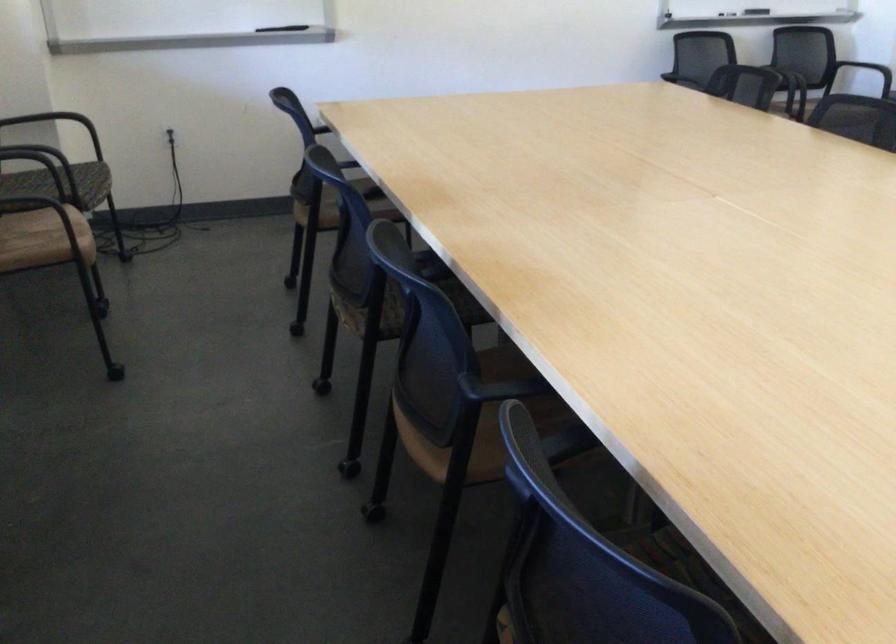
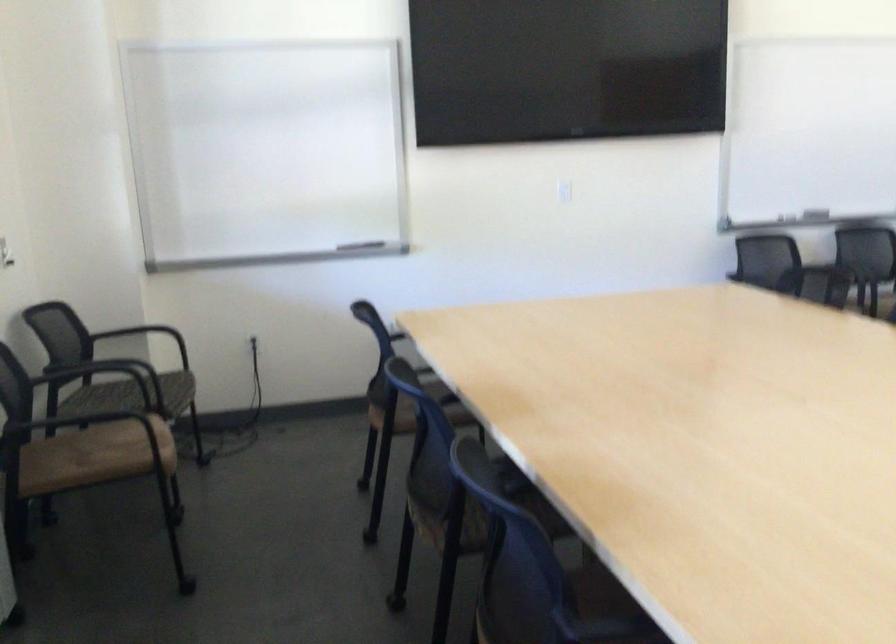
Question: How did the camera likely rotate?

Choices:
 (A) Left
 (B) Right
 (C) Up
 (D) Down

Answer: (C)